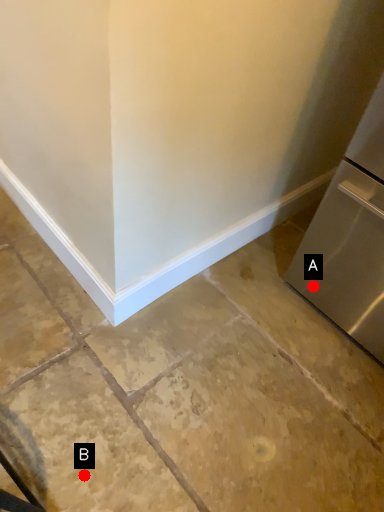
Question: Two points are circled on the image, labeled by A and B beside each circle. Which point is further to the camera?

Choices:
 (A) A is further
 (B) B is further

Answer: (A)